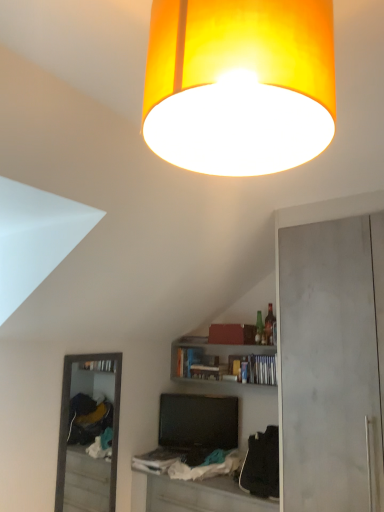
This screenshot has height=512, width=384. What do you see at coordinates (198, 421) in the screenshot? I see `black glossy television at center` at bounding box center [198, 421].

Identify the location of white fabric table at lower center. (200, 495).

Find the location of `black glossy television at center`. black glossy television at center is located at coordinates (198, 421).

In the scene shown: Between white fabric table at lower center and orange fabric lampshade at upper center, which one is positioned behind?

white fabric table at lower center.

How far apart are white fabric table at lower center and orange fabric lampshade at upper center?

2.04 meters.

Between white fabric table at lower center and orange fabric lampshade at upper center, which one has smaller width?

orange fabric lampshade at upper center is thinner.

Is orange fabric lampshade at upper center located within white fabric table at lower center?

Actually, orange fabric lampshade at upper center is outside white fabric table at lower center.

You are a GUI agent. You are given a task and a screenshot of the screen. Output one action in this format:
    pyautogui.click(x=<x>, y=<y>)
    Task: Click on the lamp that is above the black glossy television at center (from a real-world perspective)
    This screenshot has width=384, height=512.
    Given the screenshot: What is the action you would take?
    pyautogui.click(x=239, y=84)

Which object is closer to the camera, black glossy television at center or orange fabric lampshade at upper center?

orange fabric lampshade at upper center is in front.

From the image's perspective, which is below, black glossy television at center or orange fabric lampshade at upper center?

black glossy television at center.

Relative to wooden bookshelf at center, is orange fabric lampshade at upper center in front or behind?

Visually, orange fabric lampshade at upper center is located in front of wooden bookshelf at center.

Does point (241, 138) appear closer or farther from the camera than point (205, 367)?

Point (241, 138) is positioned closer to the camera compared to point (205, 367).

From the image's perspective, relative to wooden bookshelf at center, is orange fabric lampshade at upper center above or below?

Based on their image positions, orange fabric lampshade at upper center is located above wooden bookshelf at center.

Is orange fabric lampshade at upper center facing away from wooden bookshelf at center?

No.

How different are the orientations of orange fabric lampshade at upper center and white fabric table at lower center in degrees?

The angle between the facing direction of orange fabric lampshade at upper center and the facing direction of white fabric table at lower center is 175 degrees.

Is orange fabric lampshade at upper center not close to white fabric table at lower center?

Yes.

Does orange fabric lampshade at upper center have a greater width compared to white fabric table at lower center?

No.

In the scene shown: Is orange fabric lampshade at upper center oriented away from white fabric table at lower center?

orange fabric lampshade at upper center is not turned away from white fabric table at lower center.

Identify the location of lamp in front of the black glossy television at center. (239, 84).

Is black glossy television at center at the back of orange fabric lampshade at upper center?

No, orange fabric lampshade at upper center is not facing away from black glossy television at center.

What's the angular difference between orange fabric lampshade at upper center and black glossy television at center's facing directions?

155 degrees.

Is point (305, 101) closer or farther from the camera than point (181, 395)?

Point (305, 101).

Considering the sizes of objects wooden bookshelf at center and white fabric table at lower center in the image provided, who is thinner, wooden bookshelf at center or white fabric table at lower center?

With smaller width is wooden bookshelf at center.

Is wooden bookshelf at center far away from white fabric table at lower center?

They are positioned close to each other.

Is wooden bookshelf at center aimed at white fabric table at lower center?

No, wooden bookshelf at center is not facing towards white fabric table at lower center.

Are wooden bookshelf at center and black glossy television at center located far from each other?

No, wooden bookshelf at center is not far away from black glossy television at center.

In the scene shown: From a real-world perspective, which object rests below the other?

black glossy television at center is physically lower.

Which is in front, wooden bookshelf at center or black glossy television at center?

wooden bookshelf at center.

How many degrees apart are the facing directions of wooden bookshelf at center and black glossy television at center?

They differ by 31.8 degrees in their facing directions.

The width and height of the screenshot is (384, 512). In order to click on lamp located on the left of white fabric table at lower center in this screenshot , I will do `click(239, 84)`.

At what (x,y) coordinates should I click in order to perform the action: click on lamp in front of the black glossy television at center. Please return your answer as a coordinate pair (x, y). Image resolution: width=384 pixels, height=512 pixels. Looking at the image, I should click on (239, 84).

Considering their positions, is white fabric table at lower center positioned closer to wooden bookshelf at center than black glossy television at center?

Among the two, black glossy television at center is located nearer to wooden bookshelf at center.

Estimate the real-world distances between objects in this image. Which object is closer to black glossy television at center, white fabric table at lower center or orange fabric lampshade at upper center?

Based on the image, white fabric table at lower center appears to be nearer to black glossy television at center.

Considering their positions, is orange fabric lampshade at upper center positioned further to wooden bookshelf at center than black glossy television at center?

orange fabric lampshade at upper center is positioned further to the anchor wooden bookshelf at center.

Considering their positions, is white fabric table at lower center positioned further to black glossy television at center than wooden bookshelf at center?

white fabric table at lower center.

Based on the photo, based on their spatial positions, is wooden bookshelf at center or orange fabric lampshade at upper center further from white fabric table at lower center?

orange fabric lampshade at upper center is further to white fabric table at lower center.

Estimate the real-world distances between objects in this image. Which object is further from white fabric table at lower center, black glossy television at center or wooden bookshelf at center?

wooden bookshelf at center lies further to white fabric table at lower center than the other object.

Looking at the image, which one is located further to orange fabric lampshade at upper center, white fabric table at lower center or wooden bookshelf at center?

wooden bookshelf at center is further to orange fabric lampshade at upper center.

Looking at the image, which one is located further to orange fabric lampshade at upper center, wooden bookshelf at center or black glossy television at center?

black glossy television at center lies further to orange fabric lampshade at upper center than the other object.

This screenshot has height=512, width=384. What are the coordinates of `table positioned between orange fabric lampshade at upper center and wooden bookshelf at center from near to far` in the screenshot? It's located at (200, 495).

Locate an element on the screen. shelf located between orange fabric lampshade at upper center and black glossy television at center in the depth direction is located at coordinates (221, 360).

I want to click on table located between orange fabric lampshade at upper center and black glossy television at center in the depth direction, so click(200, 495).

You are a GUI agent. You are given a task and a screenshot of the screen. Output one action in this format:
    pyautogui.click(x=<x>, y=<y>)
    Task: Click on the shelf between white fabric table at lower center and black glossy television at center from front to back
    The height and width of the screenshot is (512, 384).
    Given the screenshot: What is the action you would take?
    pyautogui.click(x=221, y=360)